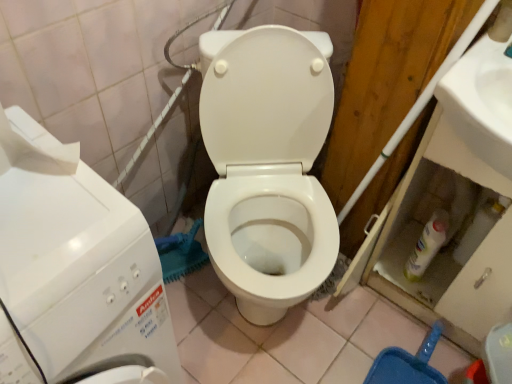
Question: Can white glossy sink at upper right be found inside white glossy toilet at center?

Choices:
 (A) no
 (B) yes

Answer: (A)

Question: Can you confirm if white glossy toilet at center is thinner than white glossy sink at upper right?

Choices:
 (A) no
 (B) yes

Answer: (A)

Question: From a real-world perspective, does white glossy toilet at center stand above white glossy sink at upper right?

Choices:
 (A) yes
 (B) no

Answer: (B)

Question: From the image's perspective, does white glossy toilet at center appear higher than white glossy sink at upper right?

Choices:
 (A) yes
 (B) no

Answer: (B)

Question: Is white glossy toilet at center positioned with its back to white glossy sink at upper right?

Choices:
 (A) yes
 (B) no

Answer: (B)

Question: Considering the relative sizes of white glossy toilet at center and white glossy sink at upper right in the image provided, is white glossy toilet at center smaller than white glossy sink at upper right?

Choices:
 (A) no
 (B) yes

Answer: (A)

Question: Is white glossy sink at upper right thinner than white glossy toilet at center?

Choices:
 (A) yes
 (B) no

Answer: (A)

Question: From the image's perspective, is white glossy sink at upper right above white glossy toilet at center?

Choices:
 (A) no
 (B) yes

Answer: (B)

Question: Can you confirm if white glossy sink at upper right is taller than white glossy toilet at center?

Choices:
 (A) no
 (B) yes

Answer: (A)

Question: Is the depth of white glossy sink at upper right greater than that of white glossy toilet at center?

Choices:
 (A) no
 (B) yes

Answer: (B)

Question: From a real-world perspective, is white glossy sink at upper right positioned over white glossy toilet at center based on gravity?

Choices:
 (A) yes
 (B) no

Answer: (A)

Question: Is white glossy sink at upper right positioned with its back to white glossy toilet at center?

Choices:
 (A) yes
 (B) no

Answer: (B)

Question: From a real-world perspective, does white glossy toilet at center sit lower than white glossy washing machine at left?

Choices:
 (A) no
 (B) yes

Answer: (B)